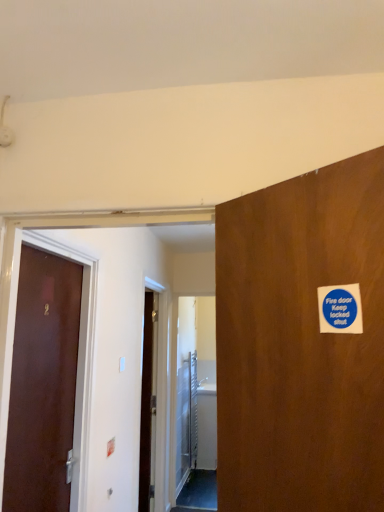
Question: Can you confirm if blue paper sticker at upper right is smaller than metallic silver elevator door at center?

Choices:
 (A) yes
 (B) no

Answer: (A)

Question: Can you confirm if blue paper sticker at upper right is taller than metallic silver elevator door at center?

Choices:
 (A) no
 (B) yes

Answer: (A)

Question: From the image's perspective, is blue paper sticker at upper right on metallic silver elevator door at center?

Choices:
 (A) yes
 (B) no

Answer: (A)

Question: Is blue paper sticker at upper right oriented towards metallic silver elevator door at center?

Choices:
 (A) yes
 (B) no

Answer: (B)

Question: Considering the relative sizes of blue paper sticker at upper right and metallic silver elevator door at center in the image provided, is blue paper sticker at upper right shorter than metallic silver elevator door at center?

Choices:
 (A) no
 (B) yes

Answer: (B)

Question: From a real-world perspective, is brown matte door at left above or below blue paper sticker at upper right?

Choices:
 (A) above
 (B) below

Answer: (B)

Question: In terms of width, does brown matte door at left look wider or thinner when compared to blue paper sticker at upper right?

Choices:
 (A) thin
 (B) wide

Answer: (B)

Question: Is point 24,483 closer or farther from the camera than point 344,306?

Choices:
 (A) farther
 (B) closer

Answer: (A)

Question: Considering the relative positions of brown matte door at left and blue paper sticker at upper right in the image provided, is brown matte door at left to the left or to the right of blue paper sticker at upper right?

Choices:
 (A) left
 (B) right

Answer: (A)

Question: Visually, is metallic silver elevator door at center positioned to the left or to the right of blue paper sticker at upper right?

Choices:
 (A) left
 (B) right

Answer: (A)

Question: Is point (183, 476) positioned closer to the camera than point (349, 331)?

Choices:
 (A) closer
 (B) farther

Answer: (B)

Question: Would you say metallic silver elevator door at center is inside or outside blue paper sticker at upper right?

Choices:
 (A) outside
 (B) inside

Answer: (A)

Question: From the image's perspective, relative to blue paper sticker at upper right, is metallic silver elevator door at center above or below?

Choices:
 (A) above
 (B) below

Answer: (B)

Question: Do you think metallic silver elevator door at center is within brown matte door at left, or outside of it?

Choices:
 (A) outside
 (B) inside

Answer: (A)

Question: Looking at their shapes, would you say metallic silver elevator door at center is wider or thinner than brown matte door at left?

Choices:
 (A) wide
 (B) thin

Answer: (A)